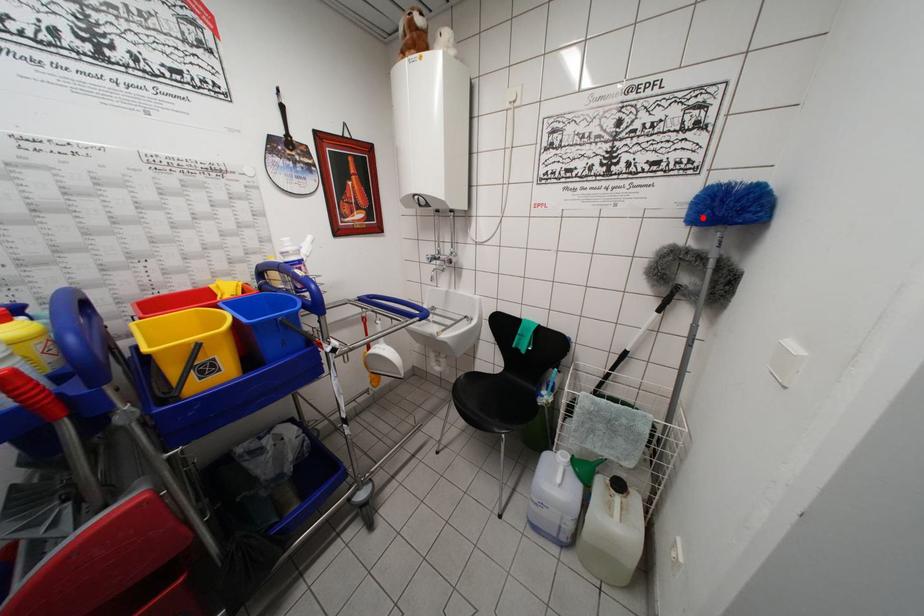
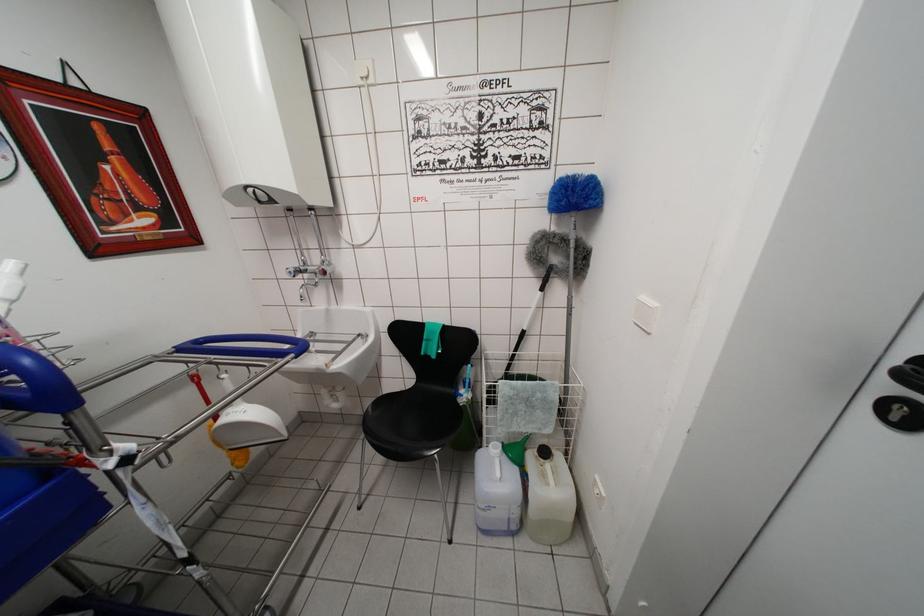
Where in the second image is the point corresponding to the highlighted location from the first image?

(562, 206)